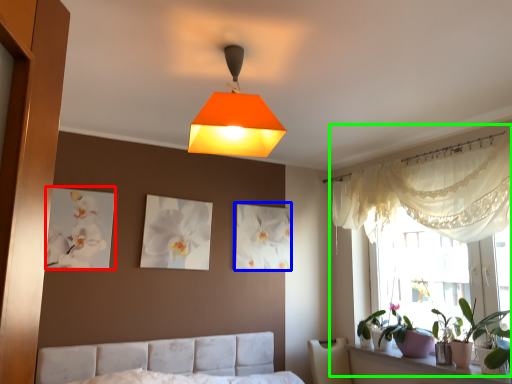
Question: Considering the real-world distances, which object is closest to picture frame (highlighted by a red box)? picture frame (highlighted by a blue box) or bay window (highlighted by a green box).

Choices:
 (A) picture frame
 (B) bay window

Answer: (A)